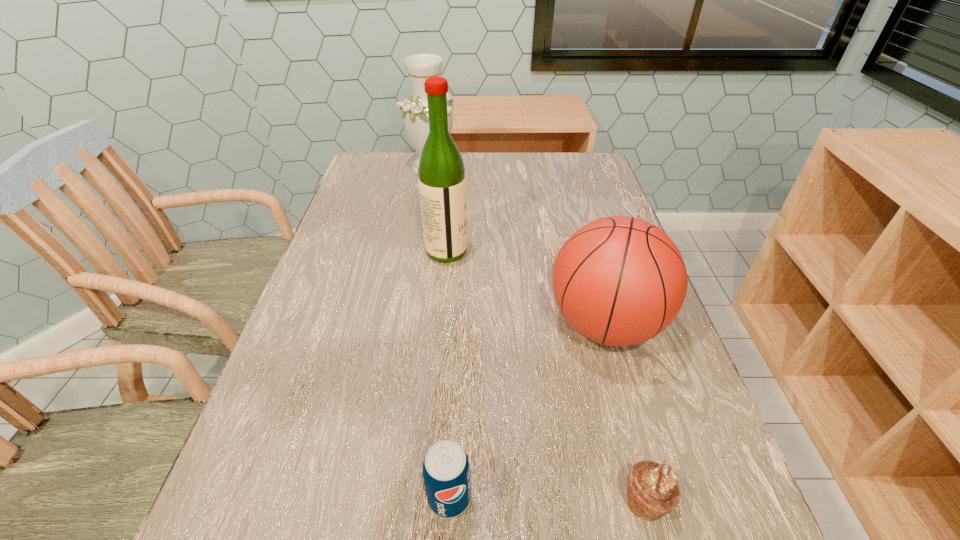
Find the location of a particular element. vacant space that satisfies the following two spatial constraints: 1. on the label of the liquor; 2. on the back side of the shortest object is located at coordinates (424, 502).

At what (x,y) coordinates should I click in order to perform the action: click on vacant space that satisfies the following two spatial constraints: 1. on the label of the muffin; 2. on the right side of the fourth nearest object. Please return your answer as a coordinate pair (x, y). Image resolution: width=960 pixels, height=540 pixels. Looking at the image, I should click on (424, 502).

Identify the location of vacant point that satisfies the following two spatial constraints: 1. on the label of the third shortest object; 2. on the left side of the liquor. (440, 325).